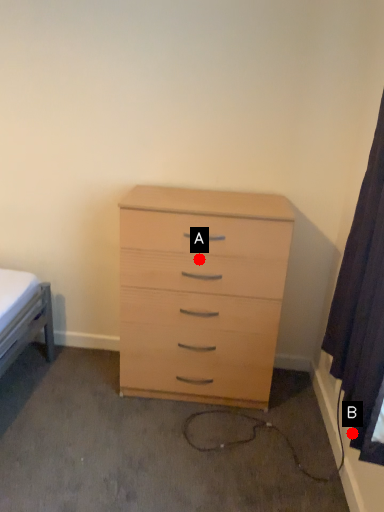
Question: Two points are circled on the image, labeled by A and B beside each circle. Which point is farther to the camera?

Choices:
 (A) A is further
 (B) B is further

Answer: (A)